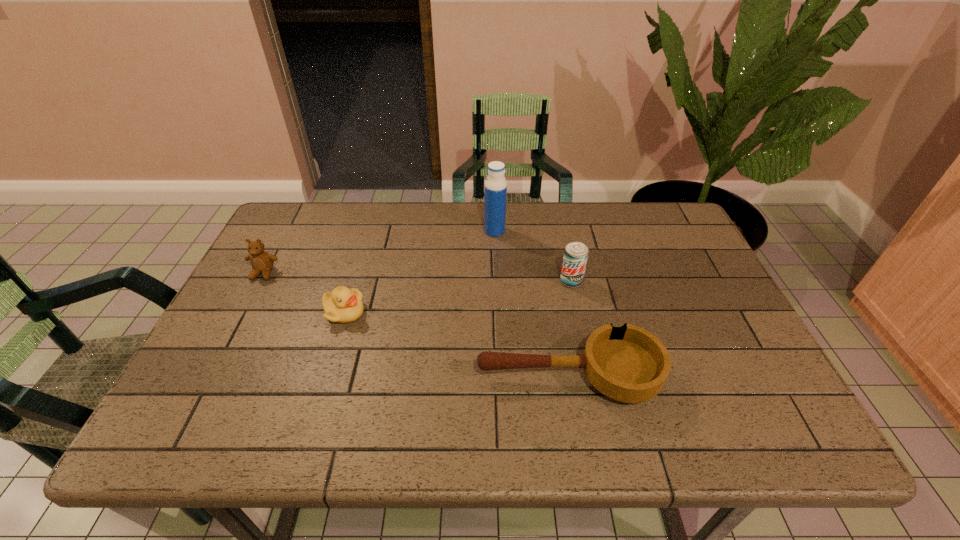
This screenshot has width=960, height=540. Find the location of `vacant position located 0.120m on the beak of the fourth farthest object`. vacant position located 0.120m on the beak of the fourth farthest object is located at coordinates (412, 313).

Where is `vacant space located with the handle on the side of the nearest object`? vacant space located with the handle on the side of the nearest object is located at coordinates (297, 376).

Identify the location of free spot located with the handle on the side of the nearest object. (347, 376).

The image size is (960, 540). I want to click on vacant space situated with the handle on the side of the nearest object, so click(x=370, y=376).

Where is `object situated at the far edge`? object situated at the far edge is located at coordinates [x=495, y=185].

Identify the location of object that is at the near edge. (629, 364).

Locate an element on the screen. The width and height of the screenshot is (960, 540). object at the left edge is located at coordinates coord(262,262).

At what (x,y) coordinates should I click in order to perform the action: click on free space at the far edge. Please return your answer as a coordinate pair (x, y). Looking at the image, I should click on (578, 220).

The width and height of the screenshot is (960, 540). Identify the location of vacant space at the near edge of the desktop. (347, 410).

You are a GUI agent. You are given a task and a screenshot of the screen. Output one action in this format:
    pyautogui.click(x=<x>, y=<y>)
    Task: Click on the free location at the left edge of the desktop
    
    Given the screenshot: What is the action you would take?
    pyautogui.click(x=252, y=333)